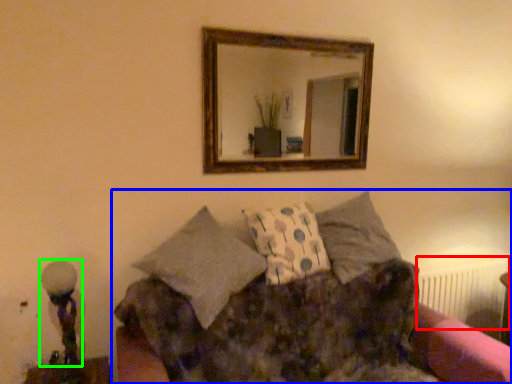
Question: Considering the real-world distances, which object is closest to radiator (highlighted by a red box)? studio couch (highlighted by a blue box) or table lamp (highlighted by a green box).

Choices:
 (A) studio couch
 (B) table lamp

Answer: (A)